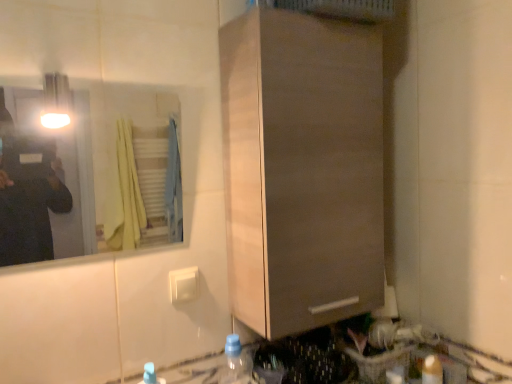
This screenshot has width=512, height=384. Find the location of `blue translucent bottle at lower center, which is counted as the 3th bottle, starting from the right`. blue translucent bottle at lower center, which is counted as the 3th bottle, starting from the right is located at coordinates (151, 375).

Locate an element on the screen. Image resolution: width=512 pixels, height=384 pixels. translucent plastic bottle at lower right, which is the 3th bottle from left to right is located at coordinates (432, 370).

Does matte wood cabinet at center have a greater height compared to translucent plastic bottle at lower right, the 1th bottle viewed from the right?

Indeed, matte wood cabinet at center has a greater height compared to translucent plastic bottle at lower right, the 1th bottle viewed from the right.

Is matte wood cabinet at center next to translucent plastic bottle at lower right, the 1th bottle viewed from the right?

No, matte wood cabinet at center is not with translucent plastic bottle at lower right, the 1th bottle viewed from the right.

From a real-world perspective, is matte wood cabinet at center on translucent plastic bottle at lower right, the 1th bottle viewed from the right?

Yes.

Is matte wood cabinet at center to the right of translucent plastic bottle at lower right, the 1th bottle viewed from the right, from the viewer's perspective?

No, matte wood cabinet at center is not to the right of translucent plastic bottle at lower right, the 1th bottle viewed from the right.

From a real-world perspective, is matte wood cabinet at center above or below translucent plastic bottle at lower center, placed as the second bottle when sorted from left to right?

From a real-world perspective, matte wood cabinet at center is physically above translucent plastic bottle at lower center, placed as the second bottle when sorted from left to right.

From the image's perspective, between matte wood cabinet at center and translucent plastic bottle at lower center, the 2th bottle from the right, which one is located above?

matte wood cabinet at center.

Identify the location of bottle that is the 2nd object located behind the matte wood cabinet at center. (236, 363).

Is blue translucent bottle at lower center, marked as the 1th bottle in a left-to-right arrangement, located outside clear glass mirror at upper left?

Yes.

Which is less distant, (153, 373) or (130, 81)?

Point (153, 373) appears to be closer to the viewer than point (130, 81).

Does blue translucent bottle at lower center, marked as the 1th bottle in a left-to-right arrangement, have a lesser height compared to clear glass mirror at upper left?

Correct, blue translucent bottle at lower center, marked as the 1th bottle in a left-to-right arrangement, is not as tall as clear glass mirror at upper left.

Considering the sizes of blue translucent bottle at lower center, which is counted as the 3th bottle, starting from the right, and matte wood cabinet at center in the image, is blue translucent bottle at lower center, which is counted as the 3th bottle, starting from the right, bigger or smaller than matte wood cabinet at center?

blue translucent bottle at lower center, which is counted as the 3th bottle, starting from the right, is smaller than matte wood cabinet at center.

From the image's perspective, is blue translucent bottle at lower center, which is counted as the 3th bottle, starting from the right, located above or below matte wood cabinet at center?

blue translucent bottle at lower center, which is counted as the 3th bottle, starting from the right, is below matte wood cabinet at center.

Is blue translucent bottle at lower center, marked as the 1th bottle in a left-to-right arrangement, to the left of matte wood cabinet at center from the viewer's perspective?

Correct, you'll find blue translucent bottle at lower center, marked as the 1th bottle in a left-to-right arrangement, to the left of matte wood cabinet at center.

How much distance is there between blue translucent bottle at lower center, marked as the 1th bottle in a left-to-right arrangement, and matte wood cabinet at center?

25.48 inches.

Which of these two, translucent plastic bottle at lower center, placed as the second bottle when sorted from left to right, or matte wood cabinet at center, stands shorter?

translucent plastic bottle at lower center, placed as the second bottle when sorted from left to right, is shorter.

Is translucent plastic bottle at lower center, placed as the second bottle when sorted from left to right, outside of matte wood cabinet at center?

Yes, translucent plastic bottle at lower center, placed as the second bottle when sorted from left to right, is outside of matte wood cabinet at center.

Which point is more forward, [234,354] or [143,376]?

The point [143,376] is closer.

From the image's perspective, which one is positioned lower, translucent plastic bottle at lower center, placed as the second bottle when sorted from left to right, or blue translucent bottle at lower center, marked as the 1th bottle in a left-to-right arrangement?

translucent plastic bottle at lower center, placed as the second bottle when sorted from left to right, appears lower in the image.

From the picture: Is translucent plastic bottle at lower center, the 2th bottle from the right, not close to blue translucent bottle at lower center, which is counted as the 3th bottle, starting from the right?

That's not correct — translucent plastic bottle at lower center, the 2th bottle from the right, is a little close to blue translucent bottle at lower center, which is counted as the 3th bottle, starting from the right.

Between clear glass mirror at upper left and blue translucent bottle at lower center, which is counted as the 3th bottle, starting from the right, which one appears on the left side from the viewer's perspective?

Positioned to the left is clear glass mirror at upper left.

From the image's perspective, between clear glass mirror at upper left and blue translucent bottle at lower center, marked as the 1th bottle in a left-to-right arrangement, who is located below?

blue translucent bottle at lower center, marked as the 1th bottle in a left-to-right arrangement, from the image's perspective.

Is clear glass mirror at upper left oriented away from blue translucent bottle at lower center, which is counted as the 3th bottle, starting from the right?

No, blue translucent bottle at lower center, which is counted as the 3th bottle, starting from the right, is not at the back of clear glass mirror at upper left.

Which of these two, clear glass mirror at upper left or blue translucent bottle at lower center, marked as the 1th bottle in a left-to-right arrangement, stands taller?

clear glass mirror at upper left.

Where is `the 3rd bottle behind the matte wood cabinet at center, starting your count from the anchor`? the 3rd bottle behind the matte wood cabinet at center, starting your count from the anchor is located at coordinates (432, 370).

At what (x,y) coordinates should I click in order to perform the action: click on cabinetry on the right of translucent plastic bottle at lower center, the 2th bottle from the right. Please return your answer as a coordinate pair (x, y). This screenshot has height=384, width=512. Looking at the image, I should click on (302, 169).

Based on their spatial positions, is translucent plastic bottle at lower right, which is the 3th bottle from left to right, or blue translucent bottle at lower center, which is counted as the 3th bottle, starting from the right, closer to clear glass mirror at upper left?

blue translucent bottle at lower center, which is counted as the 3th bottle, starting from the right, lies closer to clear glass mirror at upper left than the other object.

Estimate the real-world distances between objects in this image. Which object is closer to matte wood cabinet at center, translucent plastic bottle at lower center, placed as the second bottle when sorted from left to right, or clear glass mirror at upper left?

translucent plastic bottle at lower center, placed as the second bottle when sorted from left to right, is positioned closer to the anchor matte wood cabinet at center.

Considering their positions, is matte wood cabinet at center positioned closer to blue translucent bottle at lower center, marked as the 1th bottle in a left-to-right arrangement, than translucent plastic bottle at lower right, the 1th bottle viewed from the right?

matte wood cabinet at center is closer to blue translucent bottle at lower center, marked as the 1th bottle in a left-to-right arrangement.

Looking at the image, which one is located closer to translucent plastic bottle at lower center, the 2th bottle from the right, matte wood cabinet at center or clear glass mirror at upper left?

Based on the image, matte wood cabinet at center appears to be nearer to translucent plastic bottle at lower center, the 2th bottle from the right.

Based on their spatial positions, is matte wood cabinet at center or translucent plastic bottle at lower center, placed as the second bottle when sorted from left to right, further from blue translucent bottle at lower center, marked as the 1th bottle in a left-to-right arrangement?

matte wood cabinet at center lies further to blue translucent bottle at lower center, marked as the 1th bottle in a left-to-right arrangement, than the other object.

Estimate the real-world distances between objects in this image. Which object is closer to translucent plastic bottle at lower right, the 1th bottle viewed from the right, clear glass mirror at upper left or matte wood cabinet at center?

The object closer to translucent plastic bottle at lower right, the 1th bottle viewed from the right, is matte wood cabinet at center.

When comparing their distances from blue translucent bottle at lower center, marked as the 1th bottle in a left-to-right arrangement, does matte wood cabinet at center or clear glass mirror at upper left seem closer?

matte wood cabinet at center is closer to blue translucent bottle at lower center, marked as the 1th bottle in a left-to-right arrangement.

When comparing their distances from clear glass mirror at upper left, does matte wood cabinet at center or translucent plastic bottle at lower center, placed as the second bottle when sorted from left to right, seem closer?

Based on the image, matte wood cabinet at center appears to be nearer to clear glass mirror at upper left.

The width and height of the screenshot is (512, 384). I want to click on mirror between matte wood cabinet at center and translucent plastic bottle at lower center, placed as the second bottle when sorted from left to right, in the up-down direction, so click(x=92, y=127).

You are a GUI agent. You are given a task and a screenshot of the screen. Output one action in this format:
    pyautogui.click(x=<x>, y=<y>)
    Task: Click on the cabinetry located between clear glass mirror at upper left and translucent plastic bottle at lower right, the 1th bottle viewed from the right, in the left-right direction
    
    Given the screenshot: What is the action you would take?
    pyautogui.click(x=302, y=169)

Locate an element on the screen. Image resolution: width=512 pixels, height=384 pixels. bottle between blue translucent bottle at lower center, which is counted as the 3th bottle, starting from the right, and translucent plastic bottle at lower right, the 1th bottle viewed from the right is located at coordinates (236, 363).

In order to click on bottle between clear glass mirror at upper left and translucent plastic bottle at lower center, placed as the second bottle when sorted from left to right, in the vertical direction in this screenshot , I will do `click(151, 375)`.